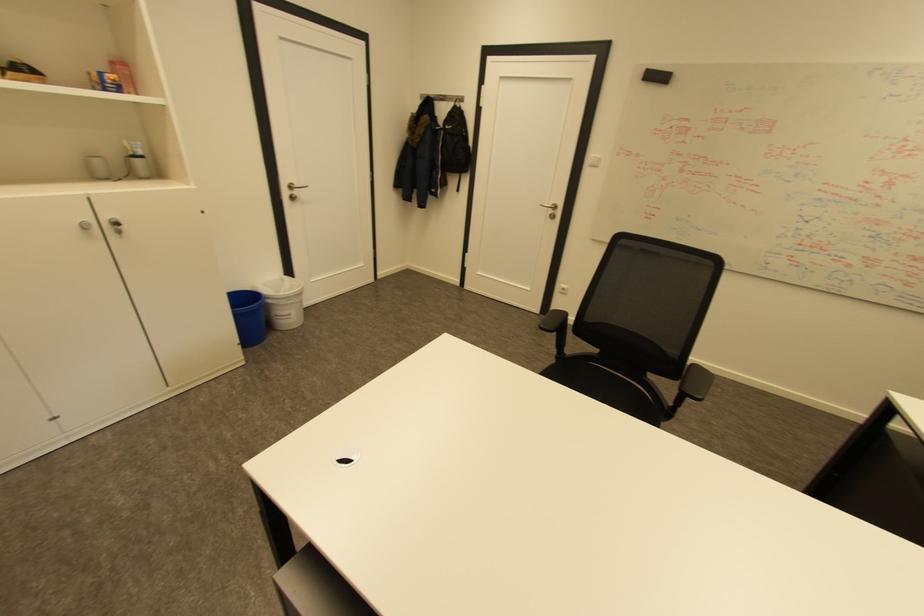
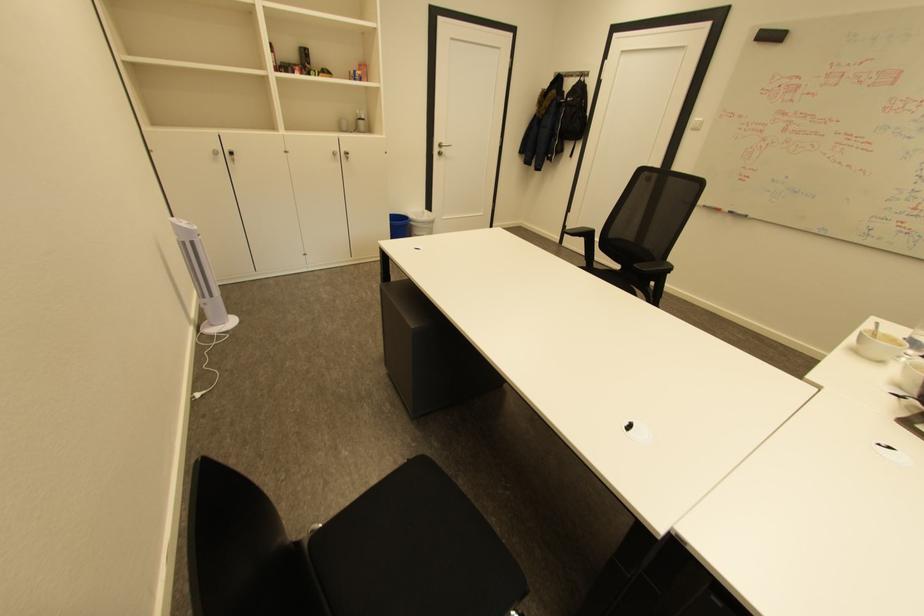
The point at (239, 312) is marked in the first image. Where is the corresponding point in the second image?

(396, 223)